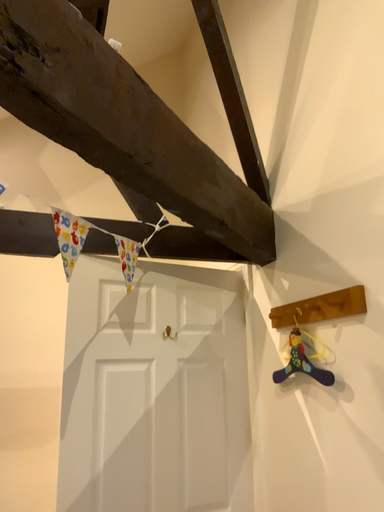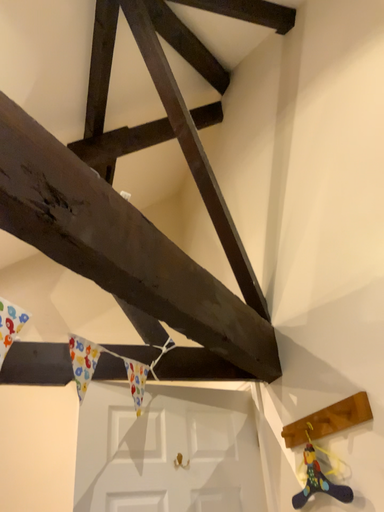
Question: Which way did the camera rotate in the video?

Choices:
 (A) rotated upward
 (B) rotated downward

Answer: (A)